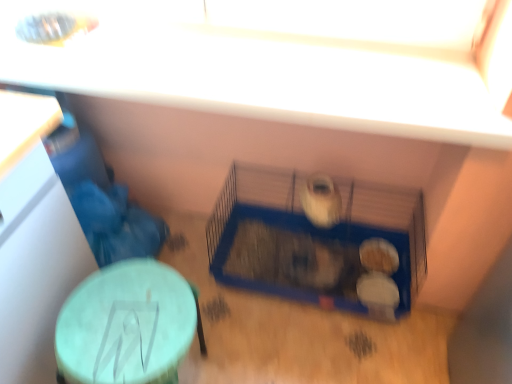
Question: Is blue plastic cage at center facing towards blue wire bird cage at center?

Choices:
 (A) no
 (B) yes

Answer: (B)

Question: Is blue plastic cage at center next to blue wire bird cage at center and touching it?

Choices:
 (A) no
 (B) yes

Answer: (B)

Question: From the image's perspective, is blue plastic cage at center above blue wire bird cage at center?

Choices:
 (A) yes
 (B) no

Answer: (B)

Question: From a real-world perspective, is blue plastic cage at center physically above blue wire bird cage at center?

Choices:
 (A) no
 (B) yes

Answer: (A)

Question: Can you confirm if blue plastic cage at center is bigger than blue wire bird cage at center?

Choices:
 (A) yes
 (B) no

Answer: (B)

Question: From the image's perspective, is blue plastic cage at center located above or below blue wire bird cage at center?

Choices:
 (A) below
 (B) above

Answer: (A)

Question: Would you say blue plastic cage at center is inside or outside blue wire bird cage at center?

Choices:
 (A) outside
 (B) inside

Answer: (B)

Question: Looking at the image, does blue plastic cage at center seem bigger or smaller compared to blue wire bird cage at center?

Choices:
 (A) small
 (B) big

Answer: (A)

Question: Is blue plastic cage at center in front of or behind blue wire bird cage at center in the image?

Choices:
 (A) front
 (B) behind

Answer: (B)

Question: Is point (158, 286) positioned closer to the camera than point (333, 286)?

Choices:
 (A) closer
 (B) farther

Answer: (A)

Question: In the image, is green matte table at lower left on the left side or the right side of blue plastic cage at center?

Choices:
 (A) right
 (B) left

Answer: (B)

Question: Is green matte table at lower left taller or shorter than blue plastic cage at center?

Choices:
 (A) short
 (B) tall

Answer: (B)

Question: Is green matte table at lower left spatially inside blue plastic cage at center, or outside of it?

Choices:
 (A) inside
 (B) outside

Answer: (B)

Question: Considering the relative positions of blue wire bird cage at center and blue plastic cage at center in the image provided, is blue wire bird cage at center to the left or to the right of blue plastic cage at center?

Choices:
 (A) left
 (B) right

Answer: (B)

Question: Looking at the image, does blue wire bird cage at center seem bigger or smaller compared to blue plastic cage at center?

Choices:
 (A) big
 (B) small

Answer: (A)